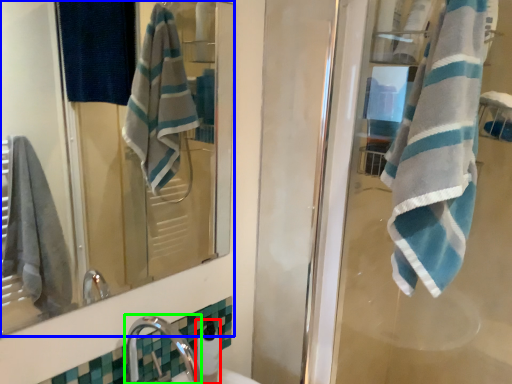
Question: Which is farther away from soap dispenser (highlighted by a red box)? mirror (highlighted by a blue box) or faucet (highlighted by a green box)?

Choices:
 (A) mirror
 (B) faucet

Answer: (A)